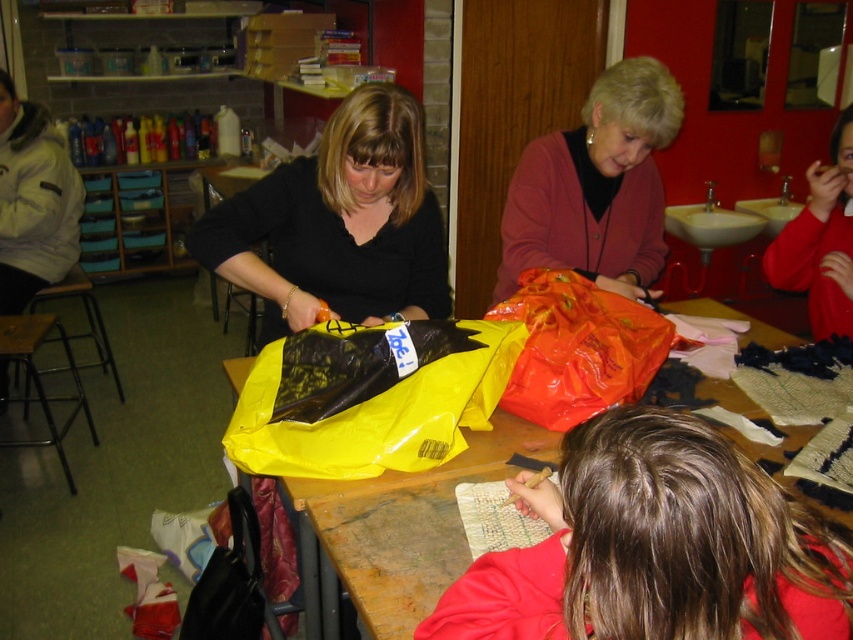
How distant is smooth red sweater at lower right from wooden table at center?

A distance of 16.14 inches exists between smooth red sweater at lower right and wooden table at center.

Between smooth red sweater at lower right and wooden table at center, which one is positioned lower?

wooden table at center is lower down.

Locate an element on the screen. The image size is (853, 640). smooth red sweater at lower right is located at coordinates (656, 547).

Identify the location of smooth red sweater at lower right. This screenshot has height=640, width=853. (656, 547).

Based on the photo, who is positioned more to the left, smooth red sweater at lower right or matte pink sweater at center?

From the viewer's perspective, smooth red sweater at lower right appears more on the left side.

How distant is smooth red sweater at lower right from matte pink sweater at center?

smooth red sweater at lower right and matte pink sweater at center are 3.62 feet apart.

Does point (469, 595) come in front of point (604, 236)?

Yes, it is.

This screenshot has height=640, width=853. Find the location of `smooth red sweater at lower right`. smooth red sweater at lower right is located at coordinates (656, 547).

Does point (541, 355) come farther from viewer compared to point (848, 116)?

No, it is not.

Is shiny plastic bag at center above red matte sweater at upper right?

Incorrect, shiny plastic bag at center is not positioned above red matte sweater at upper right.

Identify the location of shiny plastic bag at center. Image resolution: width=853 pixels, height=640 pixels. (578, 348).